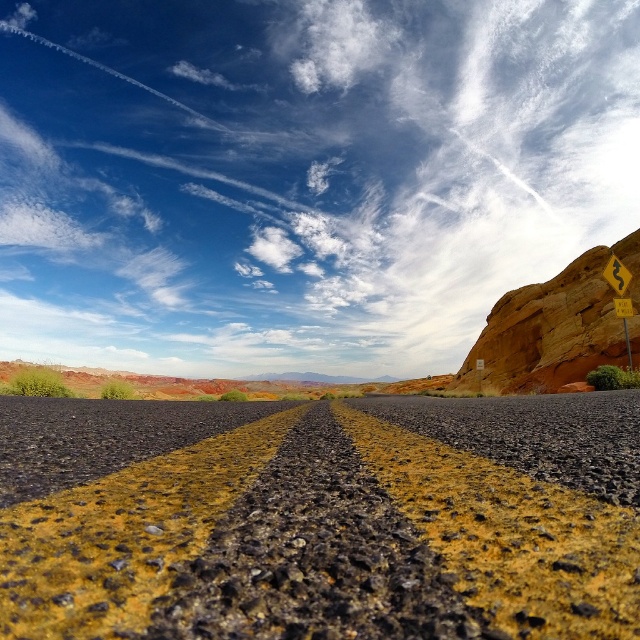
Is rustic stone mountain at right below yellow plastic road sign at right?

Indeed, rustic stone mountain at right is positioned under yellow plastic road sign at right.

Is rustic stone mountain at right wider than yellow plastic road sign at right?

Correct, the width of rustic stone mountain at right exceeds that of yellow plastic road sign at right.

Where is `rustic stone mountain at right`? rustic stone mountain at right is located at coordinates (556, 326).

Is rustic stone mountain at right further to camera compared to yellow matte road sign at right?

Yes, it is.

Between point (593, 312) and point (614, 257), which one is positioned behind?

The point (593, 312) is more distant.

This screenshot has height=640, width=640. Find the location of `rustic stone mountain at right`. rustic stone mountain at right is located at coordinates (556, 326).

Which is above, yellow plastic road sign at right or yellow matte road sign at right?

yellow matte road sign at right is above.

How far apart are yellow plastic road sign at right and yellow matte road sign at right?

A distance of 7.38 meters exists between yellow plastic road sign at right and yellow matte road sign at right.

Between point (632, 358) and point (625, 273), which one is positioned in front?

Point (625, 273) is more forward.

At what (x,y) coordinates should I click in order to perform the action: click on yellow plastic road sign at right. Please return your answer as a coordinate pair (x, y). Looking at the image, I should click on (620, 296).